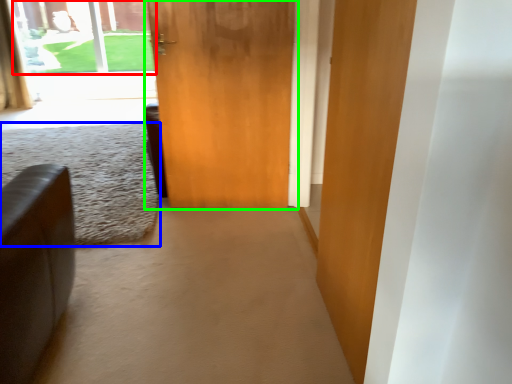
Question: Considering the real-world distances, which object is farthest from window screen (highlighted by a red box)? plain (highlighted by a blue box) or door (highlighted by a green box)?

Choices:
 (A) plain
 (B) door

Answer: (B)